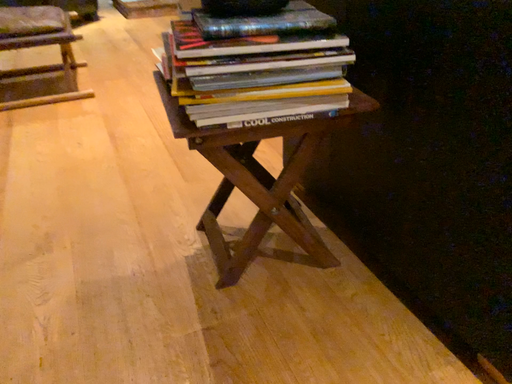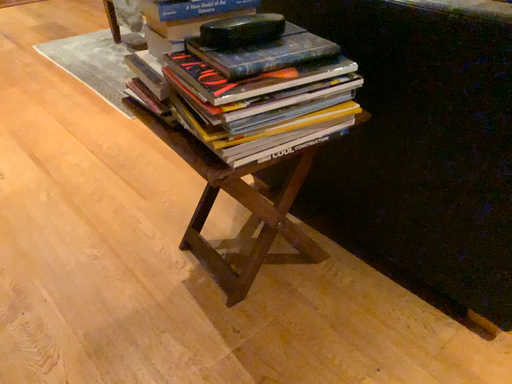
Question: How did the camera likely rotate when shooting the video?

Choices:
 (A) rotated right
 (B) rotated left

Answer: (A)